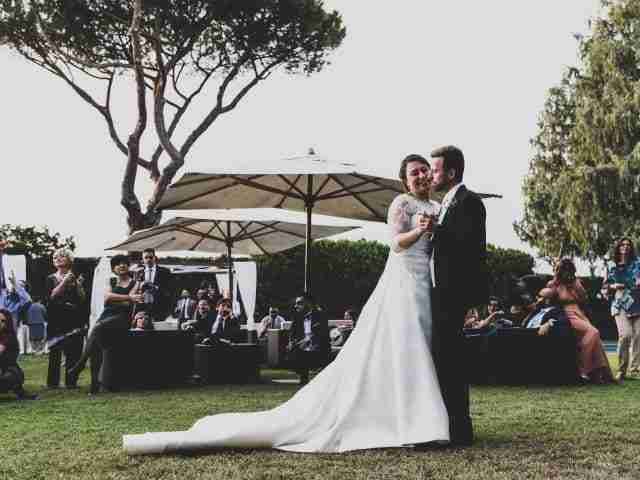
Find the location of a particular element. seating is located at coordinates (543, 351), (172, 366), (276, 345).